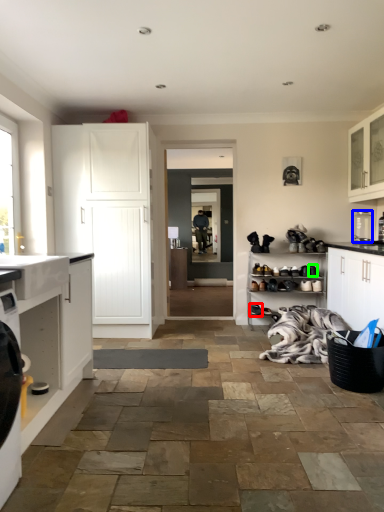
Question: Based on their relative distances, which object is farther from footwear (highlighted by a red box)? Choose from appliance (highlighted by a blue box) and shoe (highlighted by a green box).

Choices:
 (A) appliance
 (B) shoe

Answer: (A)